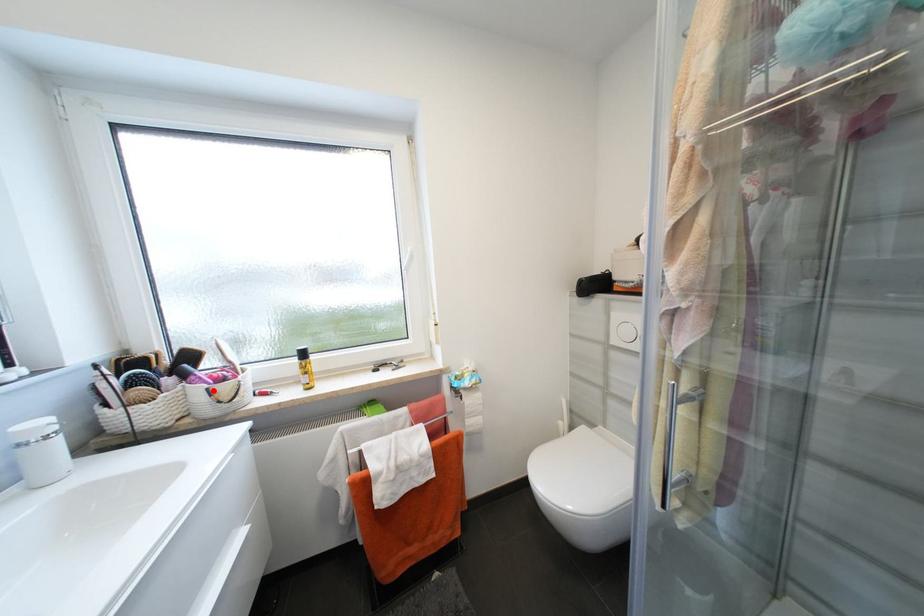
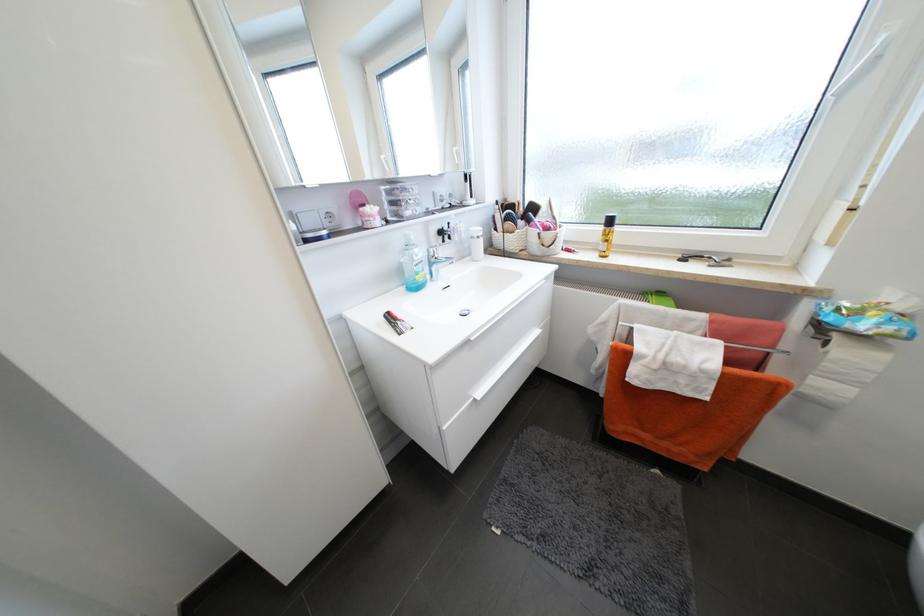
The point at the highlighted location is marked in the first image. Where is the corresponding point in the second image?

(544, 235)